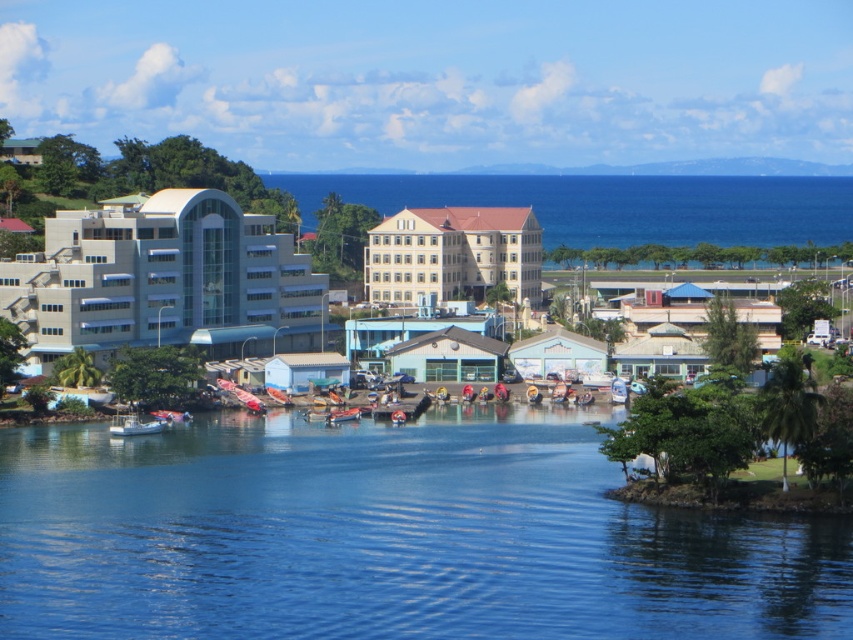
You are standing on the dock and want to know if the clear blue water at center is wider than the white plastic boat at lower left. Can you determine this based on the scene?

The clear blue water at center is wider than the white plastic boat at lower left according to the description.